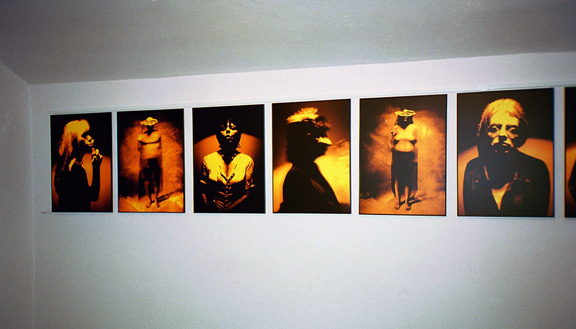
This screenshot has height=329, width=576. I want to click on wall, so click(x=206, y=270).